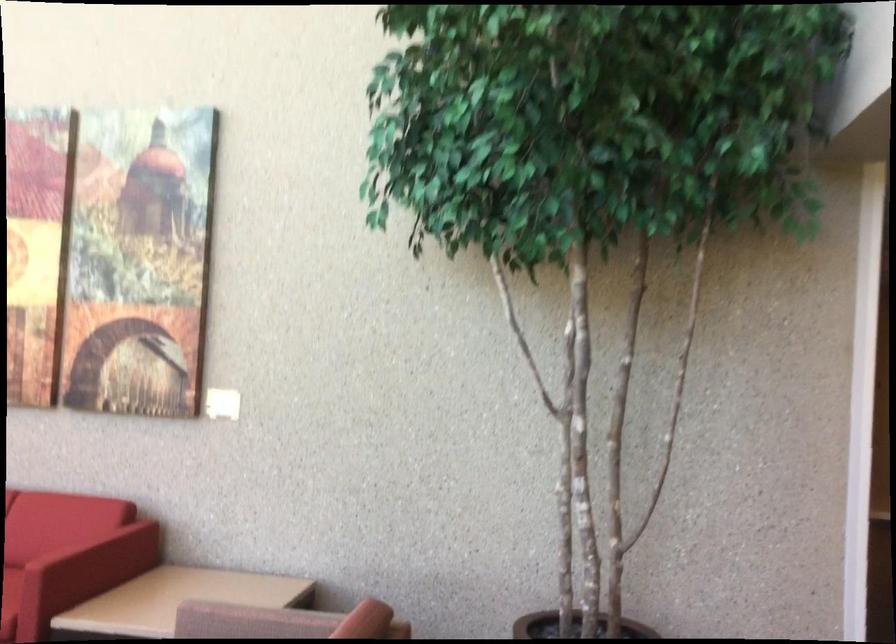
What do you see at coordinates (355, 620) in the screenshot?
I see `the brown chair armrest` at bounding box center [355, 620].